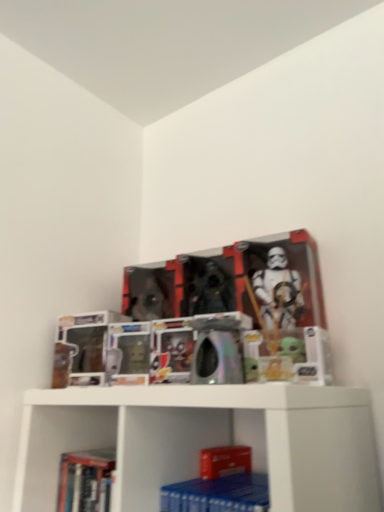
In order to face hardcover book at lower left, should I rotate leftwards or rightwards?

To face it directly, rotate left by 14.230 degrees.

What do you see at coordinates (86, 480) in the screenshot? Image resolution: width=384 pixels, height=512 pixels. I see `hardcover book at lower left` at bounding box center [86, 480].

This screenshot has height=512, width=384. I want to click on hardcover book at lower left, so click(x=86, y=480).

Where is `blue matte paperback book at lower center`? This screenshot has width=384, height=512. blue matte paperback book at lower center is located at coordinates (217, 494).

The width and height of the screenshot is (384, 512). Describe the element at coordinates (217, 494) in the screenshot. I see `blue matte paperback book at lower center` at that location.

Find the location of a particular element. Image resolution: width=384 pixels, height=512 pixels. hardcover book at lower left is located at coordinates (86, 480).

Considering the relative positions of blue matte paperback book at lower center and hardcover book at lower left in the image provided, is blue matte paperback book at lower center to the left or to the right of hardcover book at lower left?

blue matte paperback book at lower center is positioned on hardcover book at lower left's right side.

Based on the photo, is blue matte paperback book at lower center closer to camera compared to hardcover book at lower left?

Yes, blue matte paperback book at lower center is closer to the viewer.

Which is farther, (219, 508) or (72, 457)?

The point (72, 457) is more distant.

From the image's perspective, between blue matte paperback book at lower center and hardcover book at lower left, which one is located above?

→ blue matte paperback book at lower center, from the image's perspective.

From a real-world perspective, is blue matte paperback book at lower center on hardcover book at lower left?

Incorrect, from a real-world perspective, blue matte paperback book at lower center is lower than hardcover book at lower left.

Which object is wider, blue matte paperback book at lower center or hardcover book at lower left?

With larger width is blue matte paperback book at lower center.

Between blue matte paperback book at lower center and hardcover book at lower left, which one has more height?

With more height is hardcover book at lower left.

Can you confirm if blue matte paperback book at lower center is bigger than hardcover book at lower left?

Actually, blue matte paperback book at lower center might be smaller than hardcover book at lower left.

Is blue matte paperback book at lower center surrounding hardcover book at lower left?

No.

Is blue matte paperback book at lower center not near hardcover book at lower left?

blue matte paperback book at lower center is near hardcover book at lower left, not far away.

Is hardcover book at lower left at the back of blue matte paperback book at lower center?

blue matte paperback book at lower center is not turned away from hardcover book at lower left.

What's the angular difference between blue matte paperback book at lower center and hardcover book at lower left's facing directions?

They differ by 6.21e-05 degrees in their facing directions.

Measure the distance from blue matte paperback book at lower center to hardcover book at lower left.

blue matte paperback book at lower center and hardcover book at lower left are 10.25 inches apart.

You are a GUI agent. You are given a task and a screenshot of the screen. Output one action in this format:
    pyautogui.click(x=<x>, y=<y>)
    Task: Click on the paperback book on the right of the hardcover book at lower left
    
    Given the screenshot: What is the action you would take?
    pyautogui.click(x=217, y=494)

Considering the relative positions of hardcover book at lower left and blue matte paperback book at lower center in the image provided, is hardcover book at lower left to the left or to the right of blue matte paperback book at lower center?

Clearly, hardcover book at lower left is on the left of blue matte paperback book at lower center in the image.

Does hardcover book at lower left lie in front of blue matte paperback book at lower center?

That is False.

Between point (60, 489) and point (184, 508), which one is positioned behind?

The point (60, 489) is farther from the camera.

From the image's perspective, which one is positioned lower, hardcover book at lower left or blue matte paperback book at lower center?

hardcover book at lower left, from the image's perspective.

From a real-world perspective, is hardcover book at lower left positioned above or below blue matte paperback book at lower center?

Clearly, from a real-world perspective, hardcover book at lower left is above blue matte paperback book at lower center.

In terms of width, does hardcover book at lower left look wider or thinner when compared to blue matte paperback book at lower center?

In the image, hardcover book at lower left appears to be more narrow than blue matte paperback book at lower center.

Considering the sizes of objects hardcover book at lower left and blue matte paperback book at lower center in the image provided, who is taller, hardcover book at lower left or blue matte paperback book at lower center?

Standing taller between the two is hardcover book at lower left.

Looking at this image, which of these two, hardcover book at lower left or blue matte paperback book at lower center, is smaller?

blue matte paperback book at lower center.

Is hardcover book at lower left inside the boundaries of blue matte paperback book at lower center, or outside?

hardcover book at lower left is outside blue matte paperback book at lower center.

Looking at this image, does hardcover book at lower left touch blue matte paperback book at lower center?

hardcover book at lower left and blue matte paperback book at lower center are not in contact.

Is hardcover book at lower left facing away from blue matte paperback book at lower center?

hardcover book at lower left is not turned away from blue matte paperback book at lower center.

What's the angular difference between hardcover book at lower left and blue matte paperback book at lower center's facing directions?

6.21e-05 degrees.

How far apart are hardcover book at lower left and blue matte paperback book at lower center?

A distance of 26.04 centimeters exists between hardcover book at lower left and blue matte paperback book at lower center.

The image size is (384, 512). I want to click on paperback book above the hardcover book at lower left (from the image's perspective), so click(217, 494).

Find the location of `paperback book on the right of hardcover book at lower left`. paperback book on the right of hardcover book at lower left is located at coordinates (217, 494).

The height and width of the screenshot is (512, 384). I want to click on paperback book in front of the hardcover book at lower left, so click(x=217, y=494).